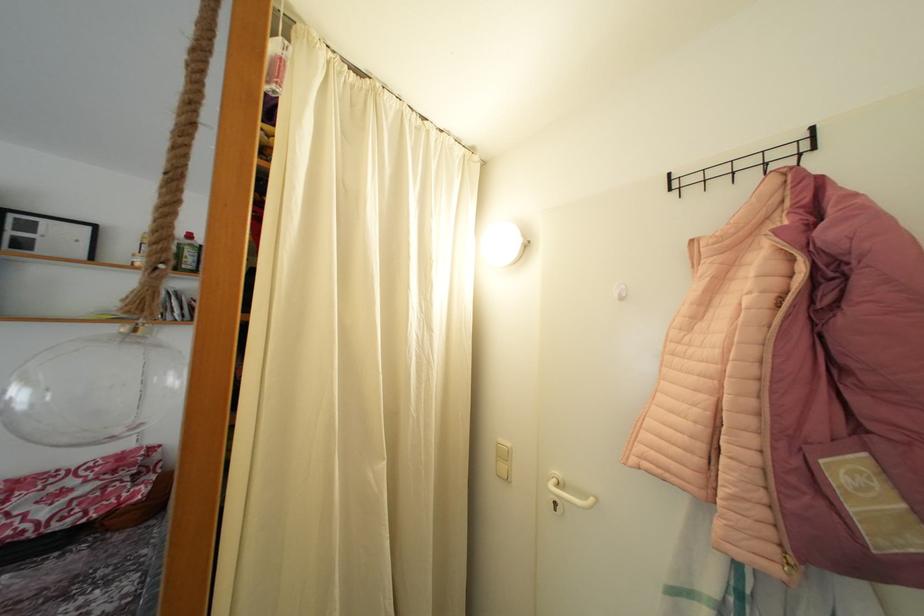
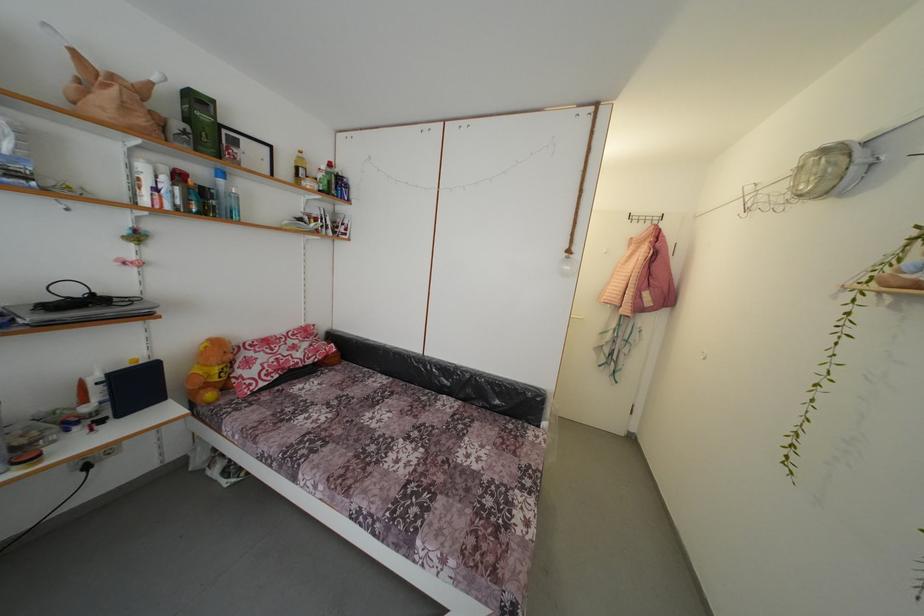
What movement of the cameraman would produce the second image?

The cameraman moved toward left, backward.